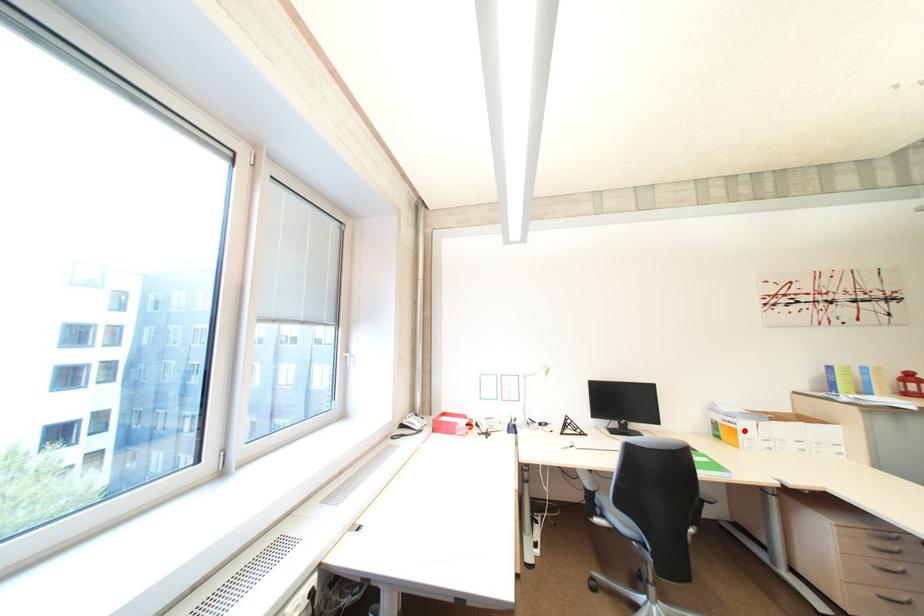
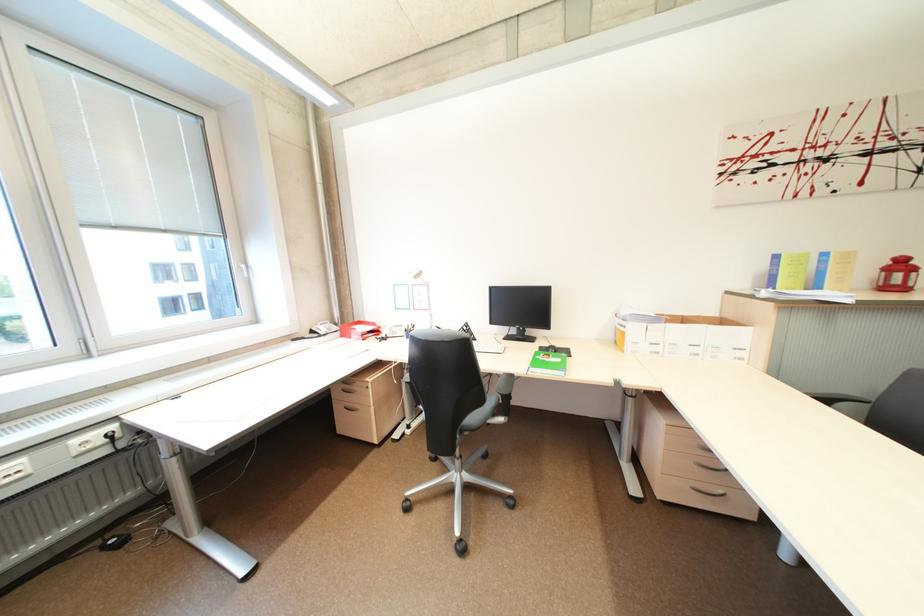
In the second image, find the point that corresponds to the highlighted location in the first image.

(633, 334)